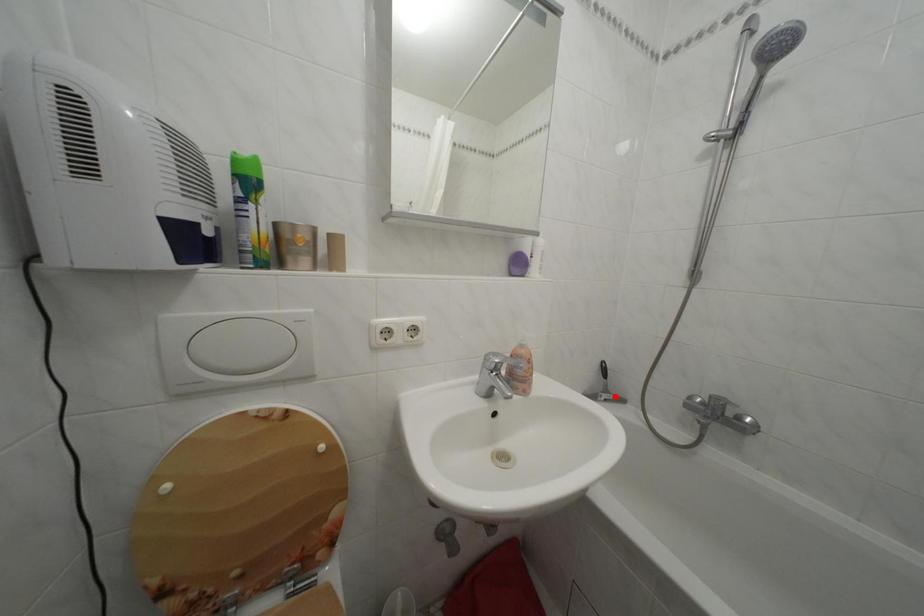
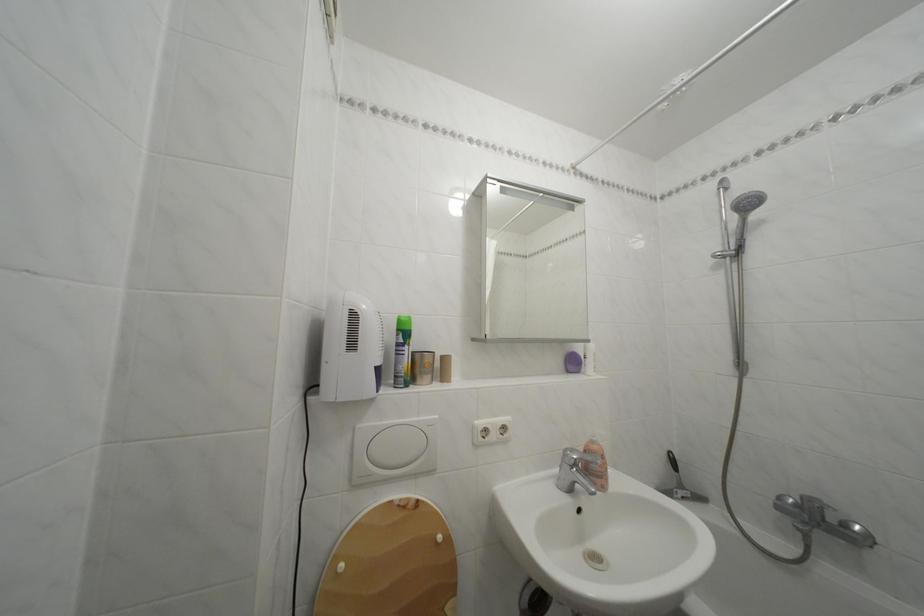
Locate, in the second image, the point that corresponds to the highlighted location in the first image.

(689, 492)